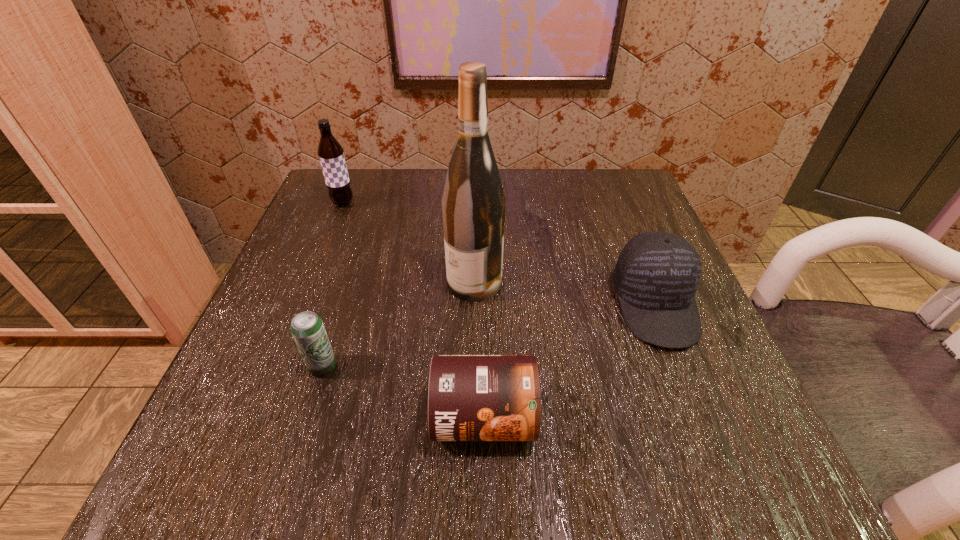
Image resolution: width=960 pixels, height=540 pixels. What are the coordinates of `vacant space situated 0.050m on the front of the fourth farthest object` in the screenshot? It's located at (309, 409).

Find the location of a particular element. object that is positioned at the far edge is located at coordinates (331, 154).

The height and width of the screenshot is (540, 960). Find the location of `object present at the near edge`. object present at the near edge is located at coordinates (470, 397).

Where is `root beer at the left edge`? The image size is (960, 540). root beer at the left edge is located at coordinates (331, 154).

Locate an element on the screen. The width and height of the screenshot is (960, 540). beer can positioned at the left edge is located at coordinates (307, 328).

The height and width of the screenshot is (540, 960). Find the location of `object present at the right edge`. object present at the right edge is located at coordinates (657, 274).

Locate an element on the screen. The image size is (960, 540). object present at the far left corner is located at coordinates (331, 154).

The width and height of the screenshot is (960, 540). Find the location of `vacant space at the far edge of the desktop`. vacant space at the far edge of the desktop is located at coordinates (409, 172).

Where is `vacant space at the left edge of the desktop`? The image size is (960, 540). vacant space at the left edge of the desktop is located at coordinates [x=311, y=402].

The width and height of the screenshot is (960, 540). In the image, there is a desktop. Identify the location of free region at the right edge. (591, 242).